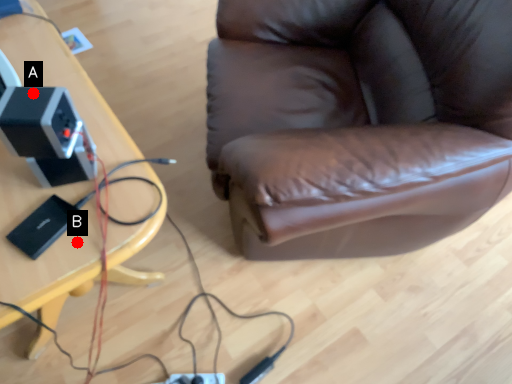
Question: Two points are circled on the image, labeled by A and B beside each circle. Which point is closer to the camera?

Choices:
 (A) A is closer
 (B) B is closer

Answer: (A)